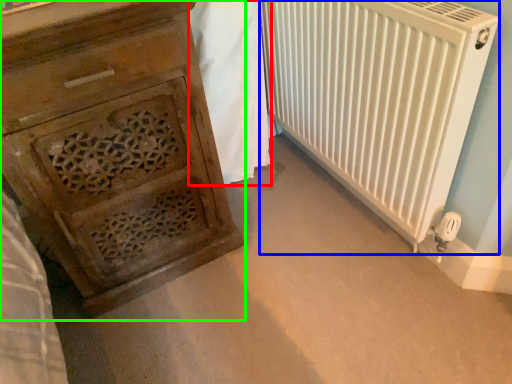
Question: Considering the real-world distances, which object is closest to blanket (highlighted by a red box)? radiator (highlighted by a blue box) or chest of drawers (highlighted by a green box).

Choices:
 (A) radiator
 (B) chest of drawers

Answer: (A)